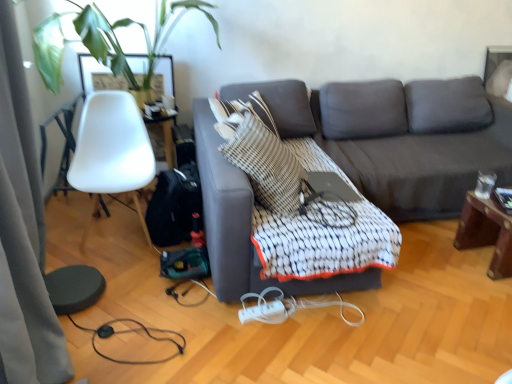
This screenshot has height=384, width=512. What are the coordinates of `vacant point to the right of black rubber cable at lower left, which appears as the 1th cable when viewed from the left` in the screenshot? It's located at (209, 349).